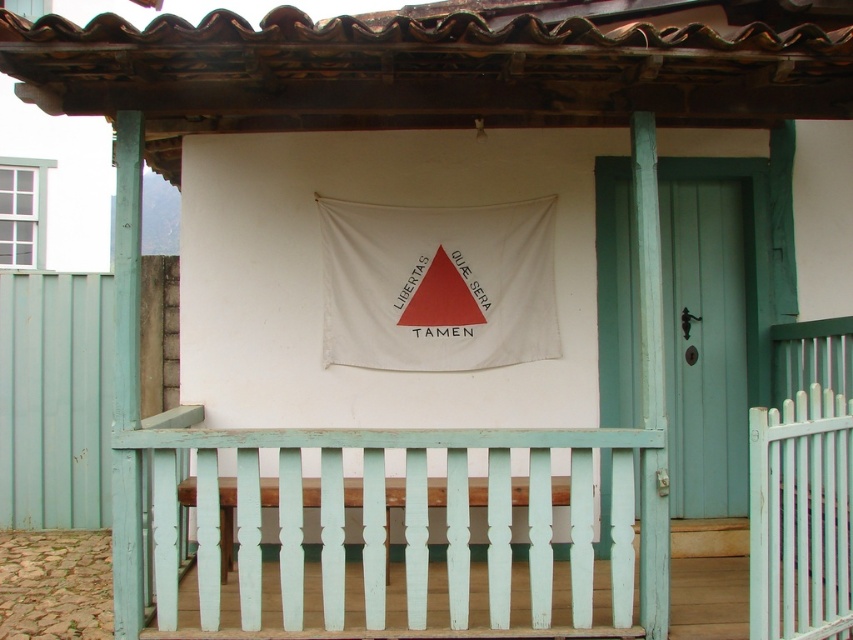
Question: Which point is farther from the camera taking this photo?

Choices:
 (A) (697, 492)
 (B) (569, 529)

Answer: (A)

Question: Is light teal wood at center closer to camera compared to teal wooden door at center right?

Choices:
 (A) no
 (B) yes

Answer: (B)

Question: Which point is farther to the camera?

Choices:
 (A) (688, 451)
 (B) (467, 516)

Answer: (A)

Question: Is light teal wood at center thinner than teal wooden door at center right?

Choices:
 (A) no
 (B) yes

Answer: (A)

Question: Is light teal wood at center below teal wooden door at center right?

Choices:
 (A) no
 (B) yes

Answer: (B)